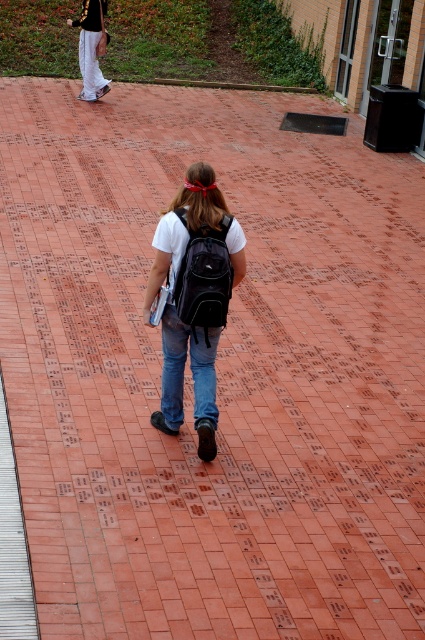
You are standing at the origin point in the image. A matte black backpack at center is located at point (193, 298). If you move 0.1 units to the right along the x axis, will you be closer to or farther from the matte black backpack at center?

Moving 0.1 units to the right along the x axis would take you to x coordinate 0.566. The original x coordinate of the matte black backpack at center is 0.466. Since 0.566 is further away from 0.466 than 0.466 is, you would be farther from the matte black backpack at center.

You are standing at the camera position and want to place a 2 meter wide banner on the ground. The banner must be placed exactly at the point marked by point (161, 410). Is the distance from the camera to this point sufficient to accommodate the banner without it being too close or too far?

The point (161, 410) is 6.01 meters away from the camera. Since the banner is 2 meters wide, this distance is sufficient as it allows enough space for the banner to be placed without being too close or too far.